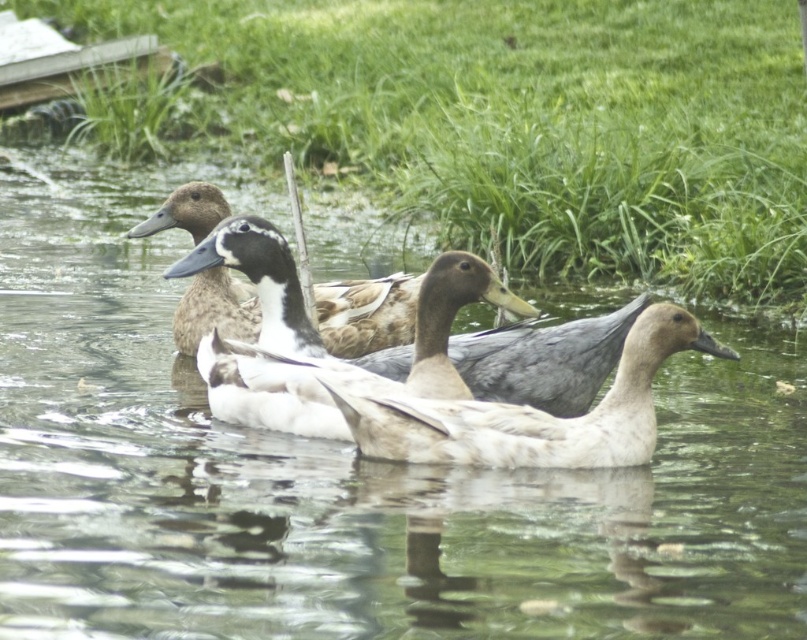
Question: Which object is farther from the camera taking this photo?

Choices:
 (A) white feathered duck at center
 (B) white matte duck at center
 (C) green grass at center
 (D) brown matte duck at center

Answer: (C)

Question: Considering the relative positions of white matte duck at center and white feathered duck at center in the image provided, where is white matte duck at center located with respect to white feathered duck at center?

Choices:
 (A) below
 (B) above

Answer: (B)

Question: Can you confirm if green grass at center is thinner than brown matte duck at center?

Choices:
 (A) yes
 (B) no

Answer: (B)

Question: Which point appears farthest from the camera in this image?

Choices:
 (A) (450, 49)
 (B) (416, 371)
 (C) (596, 412)
 (D) (182, 184)

Answer: (A)

Question: Is green grass at center closer to camera compared to white matte duck at center?

Choices:
 (A) yes
 (B) no

Answer: (B)

Question: Considering the real-world distances, which object is closest to the green grass at center?

Choices:
 (A) white matte duck at center
 (B) white feathered duck at center

Answer: (A)